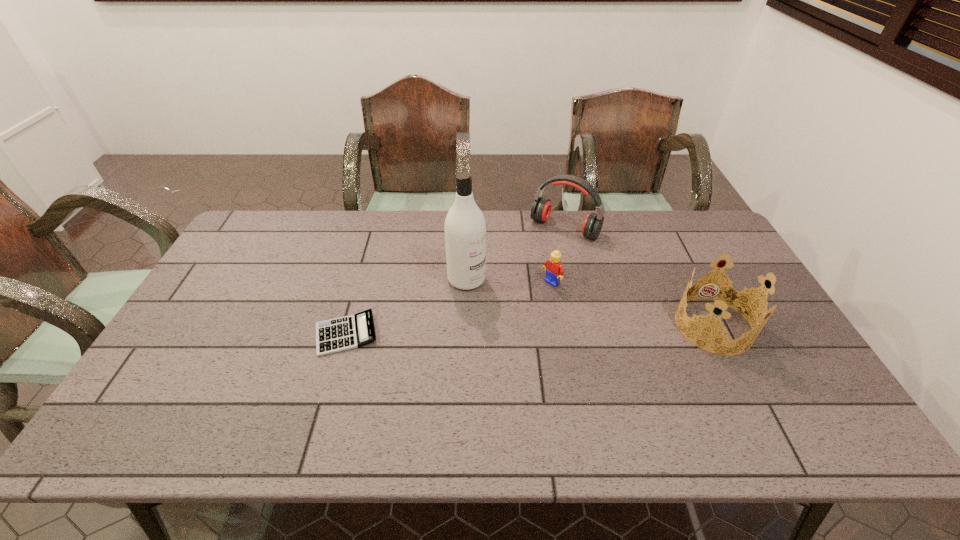
In the image, there is a desktop. Where is `vacant region at the far edge`? The height and width of the screenshot is (540, 960). vacant region at the far edge is located at coordinates (481, 210).

The height and width of the screenshot is (540, 960). In the image, there is a desktop. In order to click on free space at the near edge in this screenshot , I will do `click(396, 402)`.

This screenshot has width=960, height=540. In order to click on free space at the far left corner of the desktop in this screenshot , I will do `click(280, 212)`.

Where is `vacant region at the far right corner of the desktop`? This screenshot has height=540, width=960. vacant region at the far right corner of the desktop is located at coordinates (717, 233).

Find the location of a particular element. The image size is (960, 540). vacant point located between the fourth object from right to left and the farthest object is located at coordinates (516, 253).

Locate an element on the screen. vacant point located between the second shortest object and the leftmost object is located at coordinates (448, 309).

Identify the location of free space between the calculator and the rightmost object. The height and width of the screenshot is (540, 960). (530, 330).

Image resolution: width=960 pixels, height=540 pixels. Identify the location of vacant space that is in between the rightmost object and the Lego. (633, 305).

Where is `free spot between the farthest object and the rightmost object`? This screenshot has height=540, width=960. free spot between the farthest object and the rightmost object is located at coordinates (639, 276).

Locate an element on the screen. Image resolution: width=960 pixels, height=540 pixels. free space that is in between the crown and the calculator is located at coordinates (530, 330).